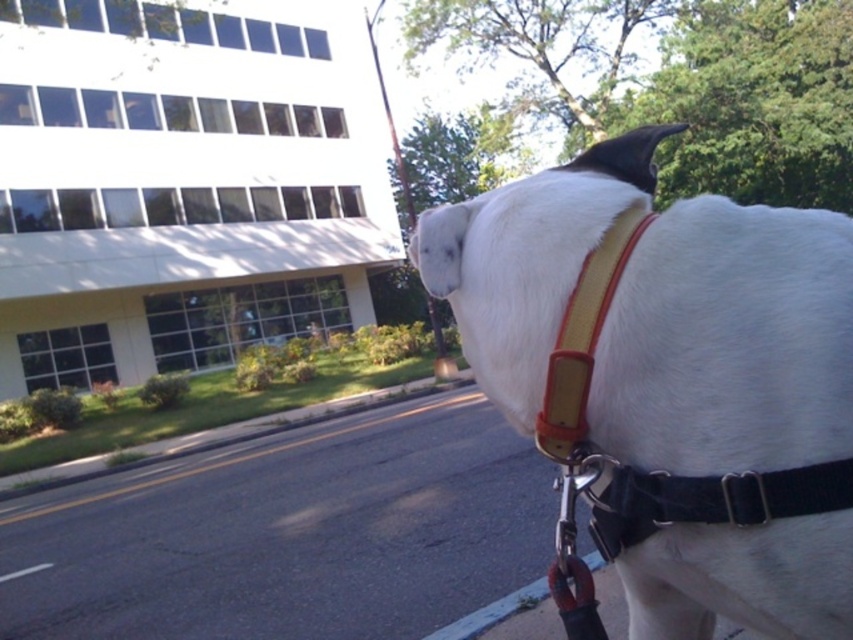
Question: In this image, where is white matte dog at center located relative to black leather strap at right?

Choices:
 (A) above
 (B) below

Answer: (B)

Question: Is white matte dog at center bigger than yellow leather strap at upper center?

Choices:
 (A) no
 (B) yes

Answer: (B)

Question: Is white matte dog at center wider than black leather strap at right?

Choices:
 (A) no
 (B) yes

Answer: (B)

Question: Which of these objects is positioned closest to the black leather strap at right?

Choices:
 (A) yellow leather strap at upper center
 (B) white matte dog at center

Answer: (B)

Question: Which point is farther to the camera?

Choices:
 (A) black leather strap at right
 (B) white matte dog at center
 (C) yellow leather strap at upper center

Answer: (C)

Question: Which point appears closest to the camera in this image?

Choices:
 (A) (624, 246)
 (B) (752, 371)
 (C) (802, 486)

Answer: (C)